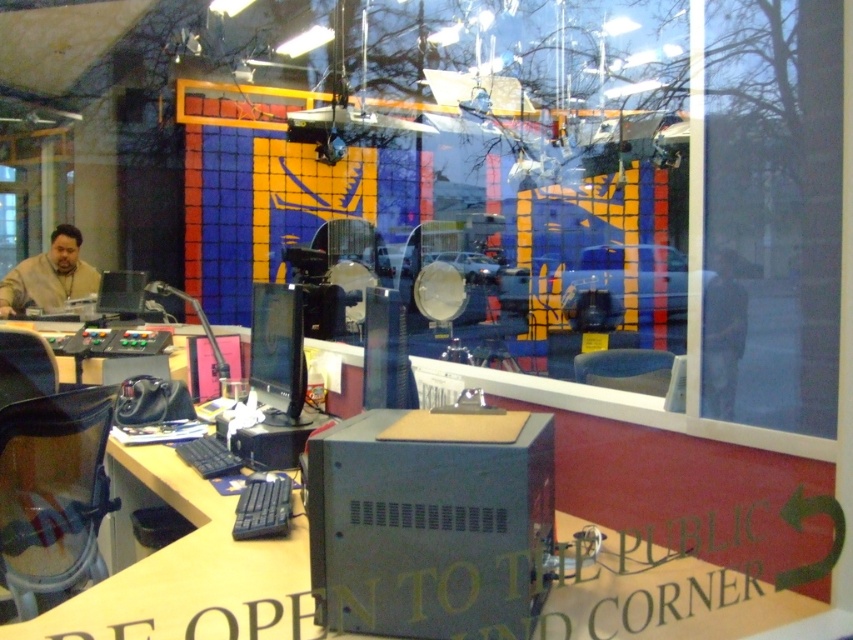
You are a technician in a studio and need to adjust the height of the keyboards to ensure proper ergonomics. Which keyboard, the blue plastic keyboard at lower left or the black plastic keyboard at center, requires adjustment to be shorter?

The blue plastic keyboard at lower left is taller than the black plastic keyboard at center, so the blue plastic keyboard at lower left requires adjustment to be shorter.

Based on the photo, you are a technician entering the studio and need to access the blue plastic keyboard at lower left. However, the metallic gray desk at center is blocking your path. Can you move the desk to reach the keyboard?

The metallic gray desk at center is positioned over blue plastic keyboard at lower left, so moving the desk would allow access to the keyboard.

You are standing in front of the studio window and see two points marked on the desk. The first point is at position point (463,108) and the second is at point (212,472). Which point is closer to you?

Point (212,472) is closer to you because point (463,108) is behind it.